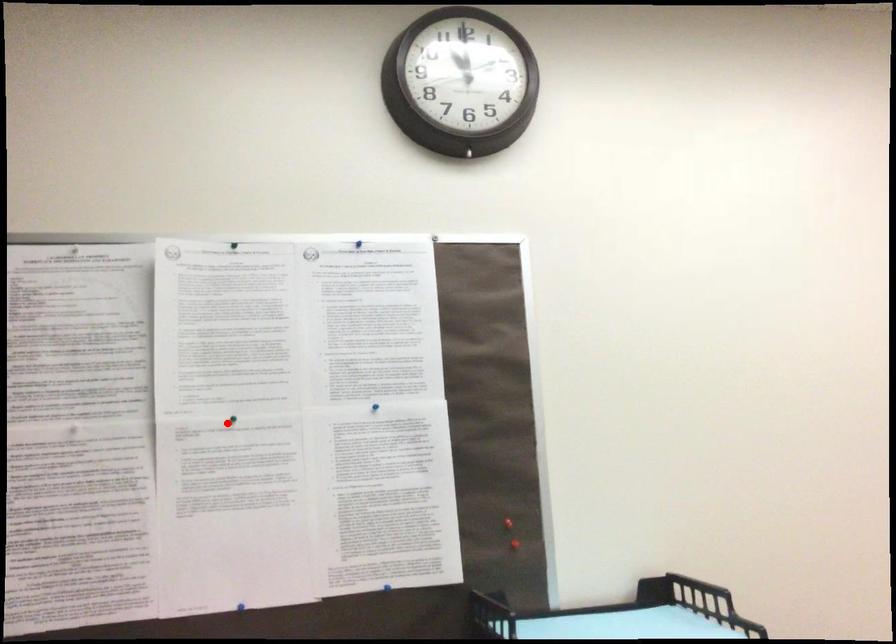
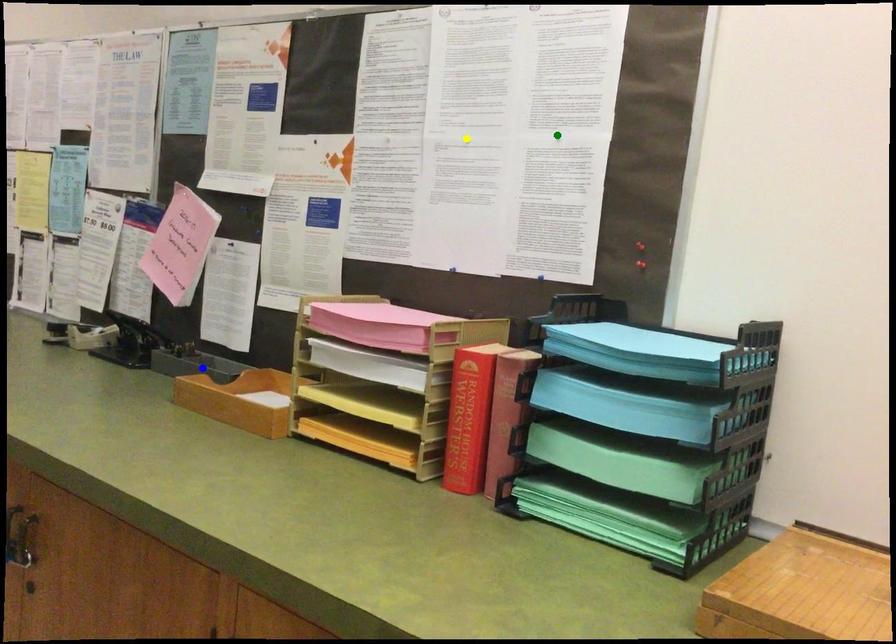
Question: I am providing you with two images of the same scene from different viewpoints. A red point is marked on the first image. You are given multiple points on the second image. In image 2, which mark is for the same physical point as the one in image 1?

Choices:
 (A) green point
 (B) blue point
 (C) yellow point

Answer: (C)